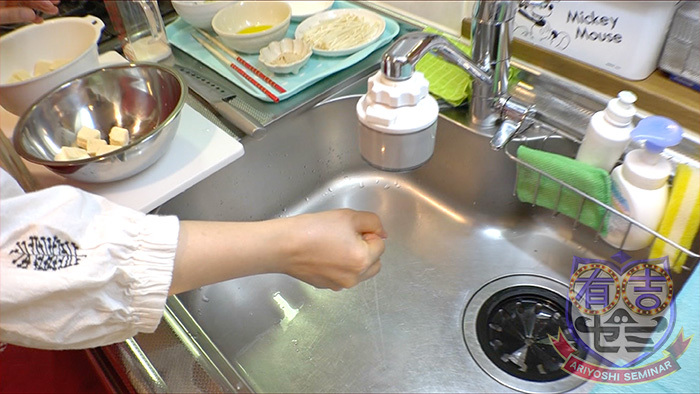
The width and height of the screenshot is (700, 394). What are the coordinates of `sponge` in the screenshot? It's located at (588, 187).